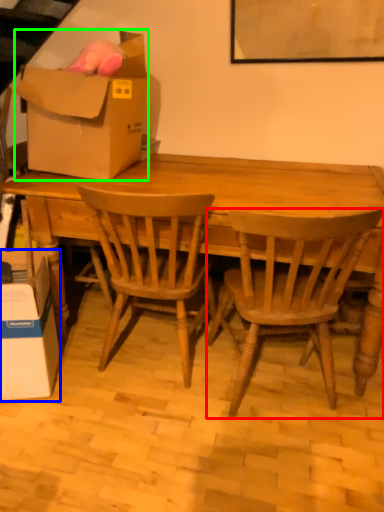
Question: Considering the real-world distances, which object is farthest from chair (highlighted by a red box)? box (highlighted by a blue box) or box (highlighted by a green box)?

Choices:
 (A) box
 (B) box

Answer: (A)